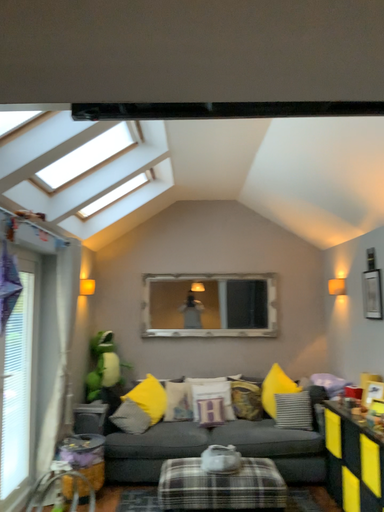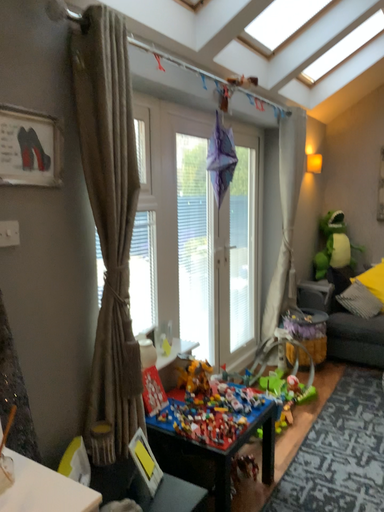
Question: How did the camera likely rotate when shooting the video?

Choices:
 (A) rotated right
 (B) rotated left

Answer: (B)